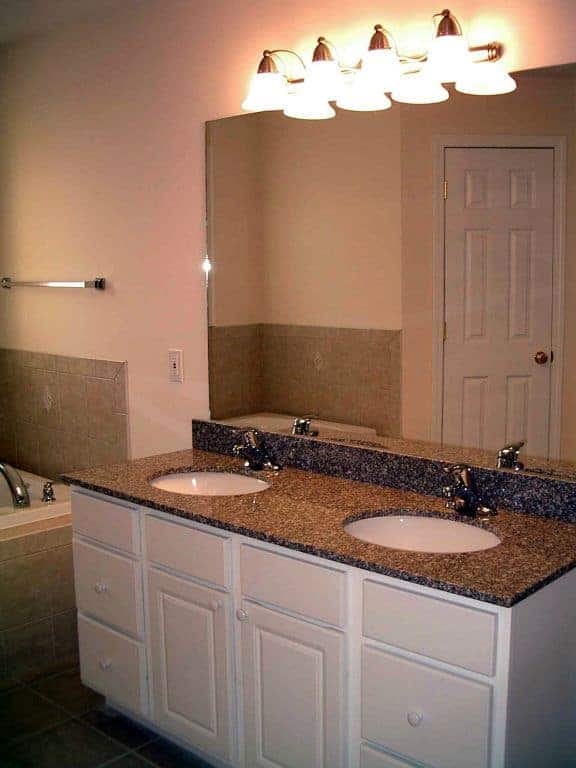
Identify the location of floor. (75, 756).